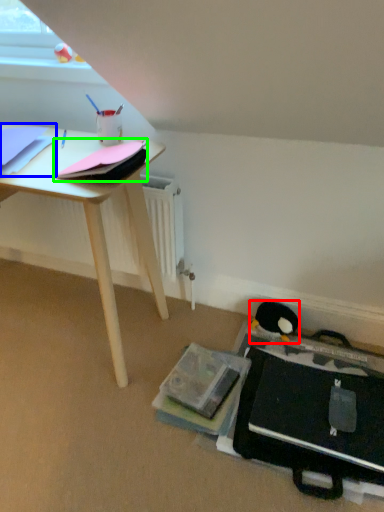
Question: Considering the real-world distances, which object is closest to penguin (highlighted by a red box)? paperback book (highlighted by a blue box) or paperback book (highlighted by a green box).

Choices:
 (A) paperback book
 (B) paperback book

Answer: (B)